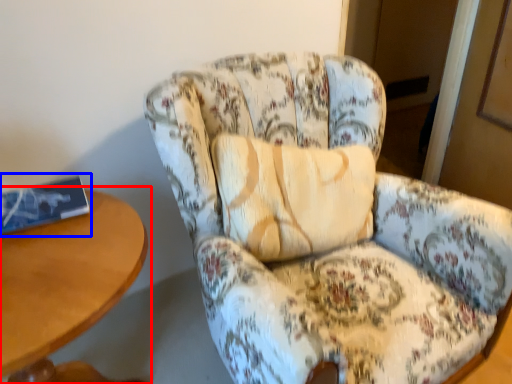
Question: Which of the following is the closest to the observer, table (highlighted by a red box) or book (highlighted by a blue box)?

Choices:
 (A) table
 (B) book

Answer: (A)